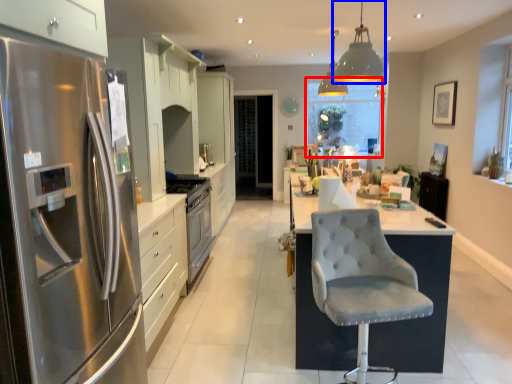
Question: Which point is further to the camera, window screen (highlighted by a red box) or light fixture (highlighted by a blue box)?

Choices:
 (A) window screen
 (B) light fixture

Answer: (A)